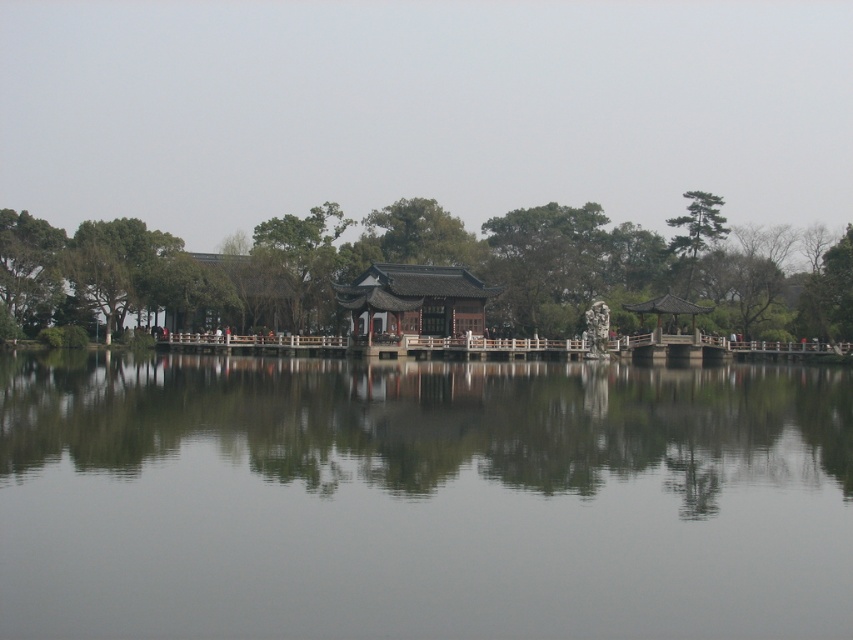
Question: Which of the following is the closest to the observer?

Choices:
 (A) (316, 406)
 (B) (289, 243)
 (C) (62, 244)

Answer: (A)

Question: Does green leafy tree at left have a lesser width compared to green matte tree at center?

Choices:
 (A) yes
 (B) no

Answer: (B)

Question: Which point appears farthest from the camera in this image?

Choices:
 (A) [714, 234]
 (B) [618, 524]
 (C) [613, 250]
 (D) [288, 224]

Answer: (C)

Question: Observing the image, what is the correct spatial positioning of transparent water at center in reference to green textured pine tree at upper right?

Choices:
 (A) left
 (B) right

Answer: (A)

Question: Among these objects, which one is farthest from the camera?

Choices:
 (A) green matte tree at center
 (B) green textured pine tree at upper right
 (C) transparent water at center

Answer: (B)

Question: Observing the image, what is the correct spatial positioning of transparent water at center in reference to green textured pine tree at upper right?

Choices:
 (A) right
 (B) left

Answer: (B)